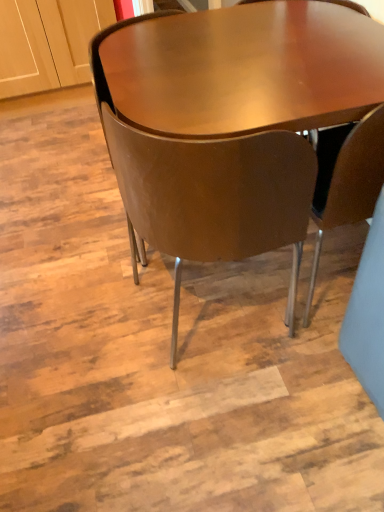
Question: From the image's perspective, is brown leather chair at center, the 2th chair viewed from the right, over brown leather chair at center, which ranks as the 3th chair in right-to-left order?

Choices:
 (A) yes
 (B) no

Answer: (B)

Question: Is brown leather chair at center, which is counted as the second chair, starting from the left, turned away from brown leather chair at center, marked as the first chair in a left-to-right arrangement?

Choices:
 (A) yes
 (B) no

Answer: (B)

Question: Considering the relative positions of brown leather chair at center, which is counted as the second chair, starting from the left, and brown leather chair at center, marked as the first chair in a left-to-right arrangement, in the image provided, is brown leather chair at center, which is counted as the second chair, starting from the left, behind brown leather chair at center, marked as the first chair in a left-to-right arrangement,?

Choices:
 (A) no
 (B) yes

Answer: (A)

Question: Considering the relative sizes of brown leather chair at center, the 2th chair viewed from the right, and brown leather chair at center, marked as the first chair in a left-to-right arrangement, in the image provided, is brown leather chair at center, the 2th chair viewed from the right, shorter than brown leather chair at center, marked as the first chair in a left-to-right arrangement,?

Choices:
 (A) no
 (B) yes

Answer: (A)

Question: From a real-world perspective, does brown leather chair at center, which is counted as the second chair, starting from the left, sit lower than brown leather chair at center, marked as the first chair in a left-to-right arrangement?

Choices:
 (A) yes
 (B) no

Answer: (A)

Question: Based on their positions, is brown leather chair at center, the 2th chair viewed from the right, located to the left or right of brown leather chair at center, marked as the first chair in a left-to-right arrangement?

Choices:
 (A) right
 (B) left

Answer: (A)

Question: Considering the positions of brown leather chair at center, the 2th chair viewed from the right, and brown leather chair at center, marked as the first chair in a left-to-right arrangement, in the image, is brown leather chair at center, the 2th chair viewed from the right, wider or thinner than brown leather chair at center, marked as the first chair in a left-to-right arrangement,?

Choices:
 (A) wide
 (B) thin

Answer: (A)

Question: From their relative heights in the image, would you say brown leather chair at center, the 2th chair viewed from the right, is taller or shorter than brown leather chair at center, marked as the first chair in a left-to-right arrangement?

Choices:
 (A) tall
 (B) short

Answer: (A)

Question: Looking at the image, does brown leather chair at center, the 2th chair viewed from the right, seem bigger or smaller compared to brown leather chair at center, marked as the first chair in a left-to-right arrangement?

Choices:
 (A) big
 (B) small

Answer: (B)

Question: Visually, is matte brown chair at center, which ranks as the 3th chair in left-to-right order, positioned to the left or to the right of brown leather chair at center, marked as the first chair in a left-to-right arrangement?

Choices:
 (A) left
 (B) right

Answer: (B)

Question: From the image's perspective, is matte brown chair at center, which ranks as the first chair in right-to-left order, above or below brown leather chair at center, marked as the first chair in a left-to-right arrangement?

Choices:
 (A) above
 (B) below

Answer: (B)

Question: From a real-world perspective, is matte brown chair at center, which ranks as the 3th chair in left-to-right order, above or below brown leather chair at center, marked as the first chair in a left-to-right arrangement?

Choices:
 (A) below
 (B) above

Answer: (A)

Question: Considering the positions of matte brown chair at center, which ranks as the first chair in right-to-left order, and brown leather chair at center, marked as the first chair in a left-to-right arrangement, in the image, is matte brown chair at center, which ranks as the first chair in right-to-left order, bigger or smaller than brown leather chair at center, marked as the first chair in a left-to-right arrangement,?

Choices:
 (A) big
 (B) small

Answer: (B)

Question: Based on their sizes in the image, would you say brown leather chair at center, which ranks as the 3th chair in right-to-left order, is bigger or smaller than matte brown chair at center, which ranks as the 3th chair in left-to-right order?

Choices:
 (A) big
 (B) small

Answer: (A)

Question: In the image, is brown leather chair at center, which ranks as the 3th chair in right-to-left order, on the left side or the right side of matte brown chair at center, which ranks as the first chair in right-to-left order?

Choices:
 (A) right
 (B) left

Answer: (B)